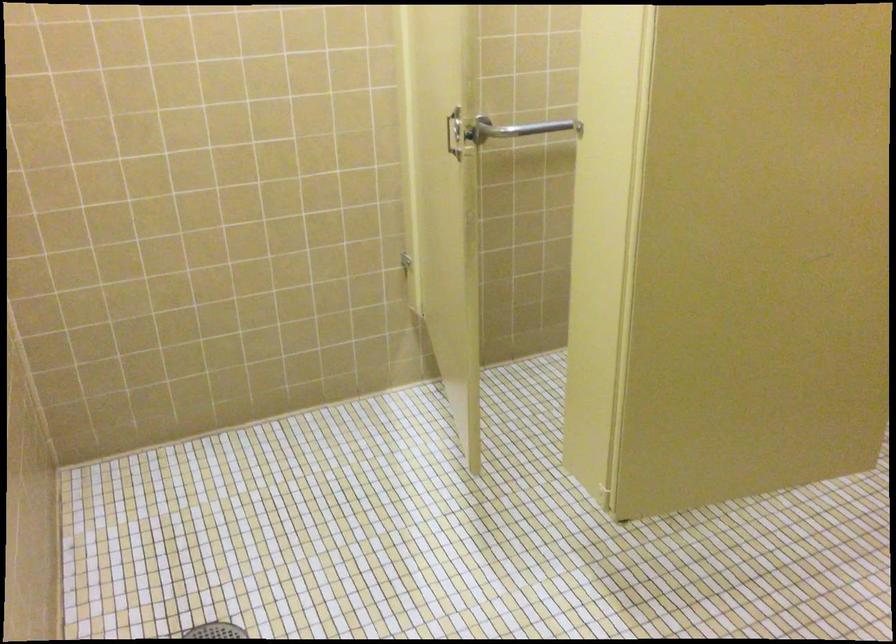
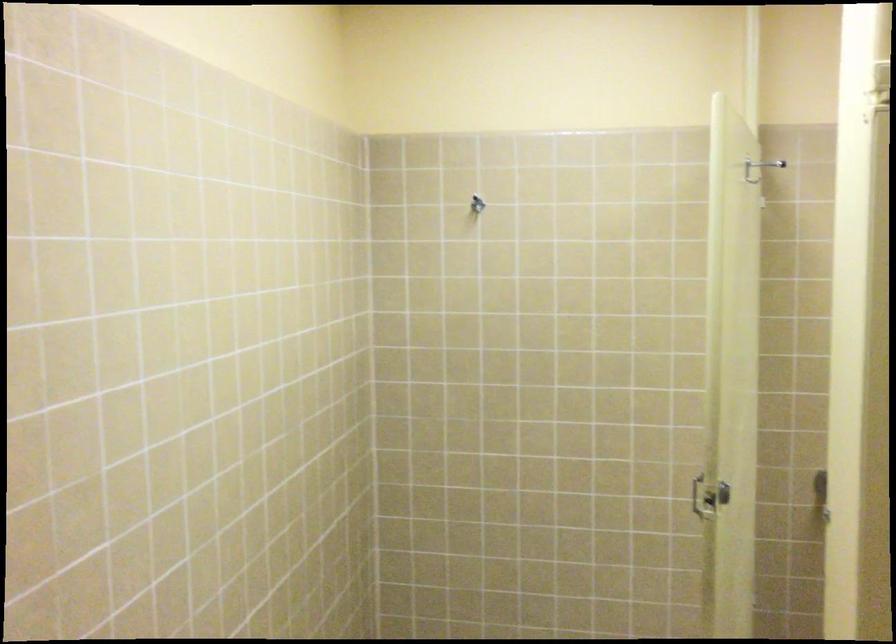
In the second image, find the point that corresponds to point (464, 152) in the first image.

(708, 497)